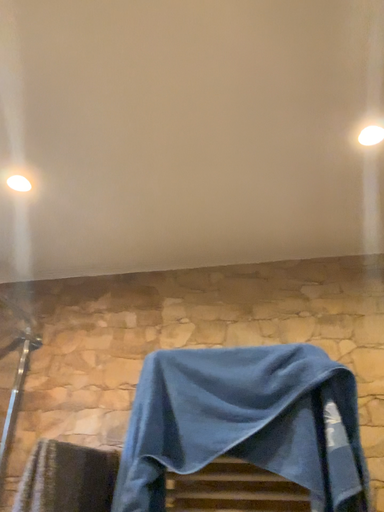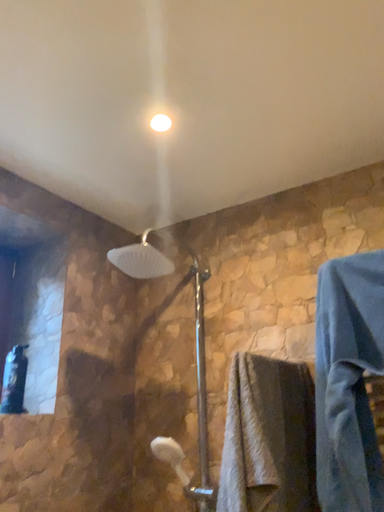
Question: How did the camera likely rotate when shooting the video?

Choices:
 (A) rotated right
 (B) rotated left

Answer: (B)